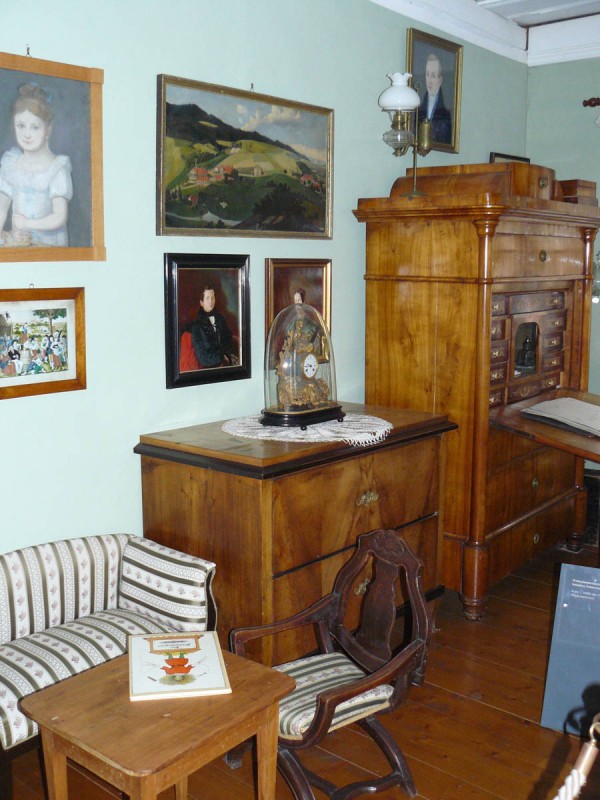
At what (x,y) coordinates should I click in order to perform the action: click on wall. Please return your answer as a coordinate pair (x, y). This screenshot has height=800, width=600. Looking at the image, I should click on (353, 102), (578, 140).